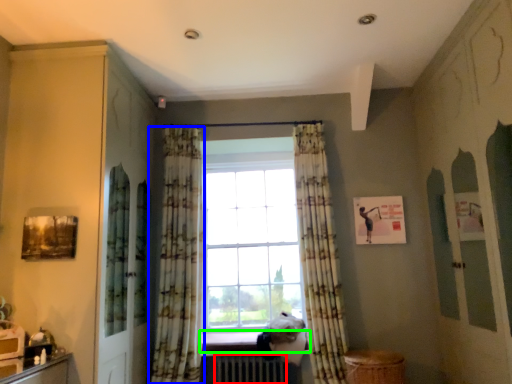
Question: Considering the real-world distances, which object is farthest from radiator (highlighted by a red box)? curtain (highlighted by a blue box) or window sill (highlighted by a green box)?

Choices:
 (A) curtain
 (B) window sill

Answer: (A)